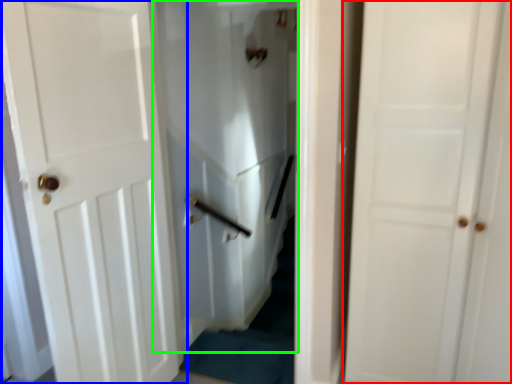
Question: Based on their relative distances, which object is farther from door (highlighted by a red box)? Choose from door (highlighted by a blue box) and elevator (highlighted by a green box).

Choices:
 (A) door
 (B) elevator

Answer: (B)